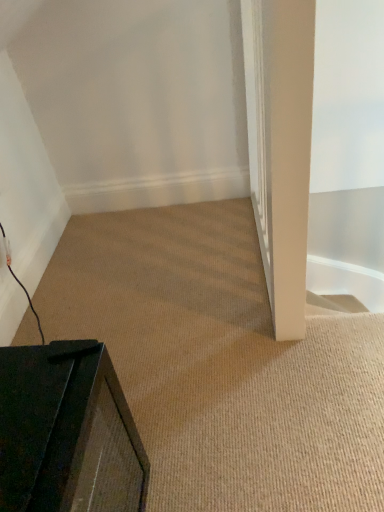
Question: Is black matte tv at lower left positioned behind black matte speaker at lower left?

Choices:
 (A) yes
 (B) no

Answer: (A)

Question: From a real-world perspective, does black matte tv at lower left sit lower than black matte speaker at lower left?

Choices:
 (A) no
 (B) yes

Answer: (B)

Question: Is black matte tv at lower left bigger than black matte speaker at lower left?

Choices:
 (A) yes
 (B) no

Answer: (A)

Question: Is black matte tv at lower left touching black matte speaker at lower left?

Choices:
 (A) no
 (B) yes

Answer: (A)

Question: Considering the relative positions of black matte tv at lower left and black matte speaker at lower left in the image provided, is black matte tv at lower left in front of black matte speaker at lower left?

Choices:
 (A) yes
 (B) no

Answer: (B)

Question: From a real-world perspective, is black matte speaker at lower left positioned above or below black matte tv at lower left?

Choices:
 (A) above
 (B) below

Answer: (A)

Question: Considering the positions of black matte speaker at lower left and black matte tv at lower left in the image, is black matte speaker at lower left wider or thinner than black matte tv at lower left?

Choices:
 (A) wide
 (B) thin

Answer: (B)

Question: From the image's perspective, is black matte speaker at lower left located above or below black matte tv at lower left?

Choices:
 (A) above
 (B) below

Answer: (B)

Question: Is black matte speaker at lower left bigger or smaller than black matte tv at lower left?

Choices:
 (A) small
 (B) big

Answer: (A)

Question: Considering the relative positions of black matte tv at lower left and white smooth pillar at right in the image provided, is black matte tv at lower left to the left or to the right of white smooth pillar at right?

Choices:
 (A) right
 (B) left

Answer: (B)

Question: Is black matte tv at lower left taller or shorter than white smooth pillar at right?

Choices:
 (A) short
 (B) tall

Answer: (A)

Question: Is point (233, 295) positioned closer to the camera than point (289, 271)?

Choices:
 (A) closer
 (B) farther

Answer: (B)

Question: Choose the correct answer: Is black matte tv at lower left inside white smooth pillar at right or outside it?

Choices:
 (A) inside
 (B) outside

Answer: (B)

Question: In terms of height, does white smooth pillar at right look taller or shorter compared to black matte speaker at lower left?

Choices:
 (A) short
 (B) tall

Answer: (B)

Question: Relative to black matte speaker at lower left, is white smooth pillar at right in front or behind?

Choices:
 (A) behind
 (B) front

Answer: (A)